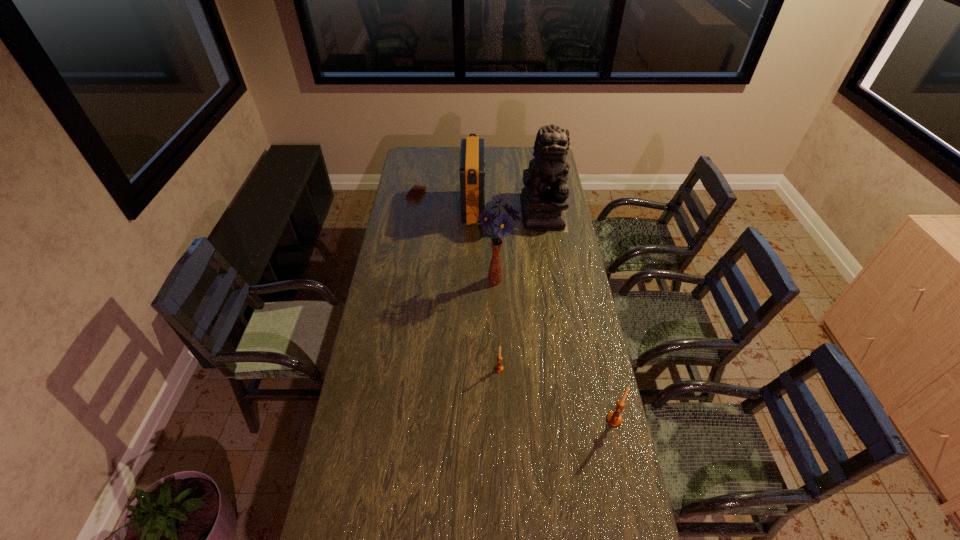
Where is `vacant space at the left edge of the desktop`? This screenshot has width=960, height=540. vacant space at the left edge of the desktop is located at coordinates (397, 229).

Where is `vacant space at the right edge`? vacant space at the right edge is located at coordinates (580, 372).

This screenshot has width=960, height=540. What are the coordinates of `vacant space at the far left corner of the desktop` in the screenshot? It's located at (417, 154).

Image resolution: width=960 pixels, height=540 pixels. What are the coordinates of `vacant area that lies between the nearest object and the shorter candle_holder` in the screenshot? It's located at (557, 394).

Find the location of `vacant point located between the shorter candle_holder and the sculpture`. vacant point located between the shorter candle_holder and the sculpture is located at coordinates (520, 289).

I want to click on vacant space that is in between the radio receiver and the nearer candle_holder, so click(544, 314).

Find the location of a particular element. The height and width of the screenshot is (540, 960). free area in between the fourth shortest object and the third nearest object is located at coordinates (484, 245).

The height and width of the screenshot is (540, 960). I want to click on vacant area that lies between the fourth shortest object and the shorter candle_holder, so click(487, 288).

This screenshot has width=960, height=540. I want to click on vacant space that's between the fourth farthest object and the leftmost object, so click(x=455, y=238).

The width and height of the screenshot is (960, 540). Find the location of `free space between the nearest object and the farther candle_holder`. free space between the nearest object and the farther candle_holder is located at coordinates (557, 394).